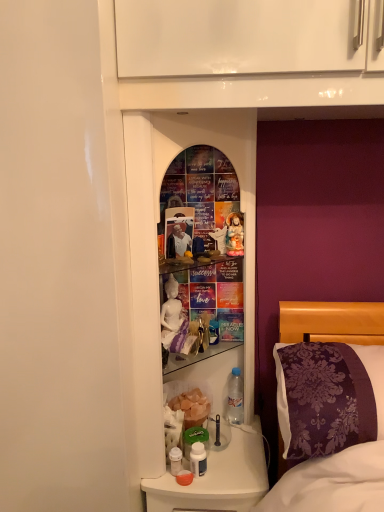
Question: From a real-world perspective, is clear plastic bottle at lower center, the 2th bottle positioned from the left, above or below purple damask pillow at right?

Choices:
 (A) below
 (B) above

Answer: (A)

Question: From the image's perspective, is clear plastic bottle at lower center, arranged as the first bottle when viewed from the top, located above or below purple damask pillow at right?

Choices:
 (A) below
 (B) above

Answer: (A)

Question: Which object is the farthest from the clear plastic bottle at lower center, which appears as the 2th bottle when ordered from the bottom?

Choices:
 (A) matte porcelain doll at center
 (B) matte white photo frame at center
 (C) translucent plastic bottles at lower center
 (D) purple damask pillow at right
 (E) white plastic bottle at lower center, placed as the 2th bottle when sorted from right to left

Answer: (B)

Question: Which is nearer to the translucent plastic bottles at lower center?

Choices:
 (A) matte white photo frame at center
 (B) white plastic bottle at lower center, marked as the second bottle in a top-to-bottom arrangement
 (C) purple damask pillow at right
 (D) clear plastic bottle at lower center, arranged as the first bottle when viewed from the top
 (E) glass mirror at center

Answer: (B)